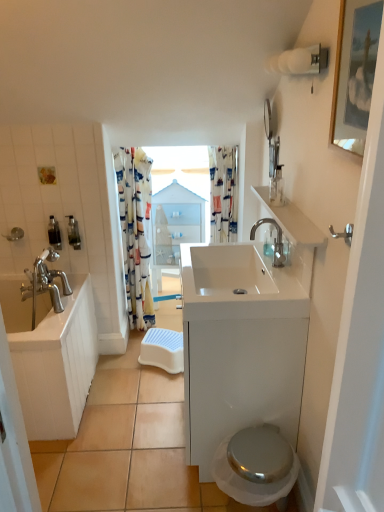
In order to face white glossy sink at upper right, should I rotate leftwards or rightwards?

You should look right and rotate roughly 11.846 degrees.

Image resolution: width=384 pixels, height=512 pixels. In order to click on white glossy sink at center in this screenshot , I will do `click(242, 283)`.

This screenshot has width=384, height=512. I want to click on white glossy cabinet at center, so click(241, 344).

At what (x,y) coordinates should I click in order to perform the action: click on metallic silver soap dispenser at left, acting as the 2th toiletry starting from the back. Please return your answer as a coordinate pair (x, y). Looking at the image, I should click on (54, 233).

Describe the element at coordinates (51, 355) in the screenshot. The width and height of the screenshot is (384, 512). I see `white glossy bathtub at left` at that location.

What is the approximate height of printed fabric shower curtain at center, which is the first shower curtain from right to left?

24.79 inches.

What are the coordinates of `white glossy sink at upper right` in the screenshot? It's located at (292, 221).

From a real-world perspective, which is physically above, silver metallic towel bar at upper right or white glossy bathtub at left?

silver metallic towel bar at upper right.

Is silver metallic towel bar at upper right looking in the opposite direction of white glossy bathtub at left?

No, silver metallic towel bar at upper right is not facing the opposite direction of white glossy bathtub at left.

Does silver metallic towel bar at upper right have a larger size compared to white glossy bathtub at left?

Incorrect, silver metallic towel bar at upper right is not larger than white glossy bathtub at left.

Choose the correct answer: Is silver metallic towel bar at upper right inside white glossy bathtub at left or outside it?

The correct answer is: outside.

From a real-world perspective, between metallic silver soap dispenser at left, positioned as the second toiletry in front-to-back order, and silver metallic towel bar at upper right, who is vertically higher?

silver metallic towel bar at upper right, from a real-world perspective.

Could you measure the distance between metallic silver soap dispenser at left, the first toiletry in the left-to-right sequence, and silver metallic towel bar at upper right?

A distance of 1.66 meters exists between metallic silver soap dispenser at left, the first toiletry in the left-to-right sequence, and silver metallic towel bar at upper right.

Between metallic silver soap dispenser at left, positioned as the second toiletry in front-to-back order, and silver metallic towel bar at upper right, which one has larger width?

Wider between the two is metallic silver soap dispenser at left, positioned as the second toiletry in front-to-back order.

Are metallic silver soap dispenser at left, acting as the 2th toiletry starting from the back, and silver metallic towel bar at upper right far apart?

Yes, metallic silver soap dispenser at left, acting as the 2th toiletry starting from the back, is far from silver metallic towel bar at upper right.

From the image's perspective, which is below, metallic silver toilet at lower right or white glossy sink at upper right?

metallic silver toilet at lower right, from the image's perspective.

Could you tell me if metallic silver toilet at lower right is turned towards white glossy sink at upper right?

No, metallic silver toilet at lower right does not turn towards white glossy sink at upper right.

Between point (287, 480) and point (292, 239), which one is positioned in front?

The point (292, 239) is in front.

Which is in front, printed fabric shower curtain at center, which is the first shower curtain from right to left, or white printed fabric shower curtain at left, the first shower curtain from the left?

white printed fabric shower curtain at left, the first shower curtain from the left.

Is there a large distance between printed fabric shower curtain at center, which is the first shower curtain from right to left, and white printed fabric shower curtain at left, the 2th shower curtain in the right-to-left sequence?

Actually, printed fabric shower curtain at center, which is the first shower curtain from right to left, and white printed fabric shower curtain at left, the 2th shower curtain in the right-to-left sequence, are a little close together.

Considering the relative sizes of printed fabric shower curtain at center, the second shower curtain positioned from the left, and white printed fabric shower curtain at left, the 2th shower curtain in the right-to-left sequence, in the image provided, is printed fabric shower curtain at center, the second shower curtain positioned from the left, taller than white printed fabric shower curtain at left, the 2th shower curtain in the right-to-left sequence,?

No, printed fabric shower curtain at center, the second shower curtain positioned from the left, is not taller than white printed fabric shower curtain at left, the 2th shower curtain in the right-to-left sequence.

Would you say white glossy sink at center is a long distance from white glossy sink at upper right?

No, white glossy sink at center is not far from white glossy sink at upper right.

From a real-world perspective, does white glossy sink at center sit lower than white glossy sink at upper right?

Yes.

Could you tell me if white glossy sink at center is turned towards white glossy sink at upper right?

No, white glossy sink at center is not aimed at white glossy sink at upper right.

In the image, there is a white glossy sink at center. Where is `counter top above it (from the image's perspective)`? counter top above it (from the image's perspective) is located at coordinates (292, 221).

From a real-world perspective, who is located lower, clear glass jar at upper right, marked as the first toiletry in a front-to-back arrangement, or satin nickel faucet at upper right?

satin nickel faucet at upper right is physically lower.

What's the angular difference between clear glass jar at upper right, acting as the third toiletry starting from the left, and satin nickel faucet at upper right's facing directions?

The angular difference between clear glass jar at upper right, acting as the third toiletry starting from the left, and satin nickel faucet at upper right is 0.0057 degrees.

Is clear glass jar at upper right, marked as the first toiletry in a front-to-back arrangement, inside or outside of satin nickel faucet at upper right?

clear glass jar at upper right, marked as the first toiletry in a front-to-back arrangement, cannot be found inside satin nickel faucet at upper right.

Is clear glass jar at upper right, arranged as the first toiletry when viewed from the right, looking in the opposite direction of satin nickel faucet at upper right?

That's not correct — clear glass jar at upper right, arranged as the first toiletry when viewed from the right, is not looking away from satin nickel faucet at upper right.

Is metallic silver toilet at lower right a part of printed fabric shower curtain at center, which is the first shower curtain from right to left?

Actually, metallic silver toilet at lower right is outside printed fabric shower curtain at center, which is the first shower curtain from right to left.

Is printed fabric shower curtain at center, which is the first shower curtain from right to left, aimed at metallic silver toilet at lower right?

Yes, printed fabric shower curtain at center, which is the first shower curtain from right to left, is aimed at metallic silver toilet at lower right.

How many degrees apart are the facing directions of printed fabric shower curtain at center, the second shower curtain positioned from the left, and metallic silver toilet at lower right?

90 degrees separate the facing orientations of printed fabric shower curtain at center, the second shower curtain positioned from the left, and metallic silver toilet at lower right.

I want to click on towel bar that appears in front of the white glossy bathtub at left, so click(x=343, y=233).

At what (x,y) coordinates should I click in order to perform the action: click on towel bar above the metallic silver soap dispenser at left, the first toiletry in the left-to-right sequence (from a real-world perspective). Please return your answer as a coordinate pair (x, y). The image size is (384, 512). Looking at the image, I should click on point(343,233).

Considering their positions, is silver metallic towel bar at upper right positioned closer to white glossy bathtub at left than wooden framed picture at upper right?

silver metallic towel bar at upper right lies closer to white glossy bathtub at left than the other object.

Based on their spatial positions, is white glossy cabinet at center or metallic silver soap dispenser at left, the first toiletry in the left-to-right sequence, closer to wooden framed picture at upper right?

white glossy cabinet at center is positioned closer to the anchor wooden framed picture at upper right.

When comparing their distances from satin nickel faucet at upper right, does white glossy sink at upper right or silver metallic towel bar at upper right seem closer?

Based on the image, white glossy sink at upper right appears to be nearer to satin nickel faucet at upper right.

When comparing their distances from metallic silver toilet at lower right, does satin nickel faucet at upper right or clear glass jar at upper right, acting as the third toiletry starting from the left, seem closer?

satin nickel faucet at upper right is closer to metallic silver toilet at lower right.

Considering their positions, is glossy glass mirror at upper right positioned closer to clear glass jar at upper right, marked as the first toiletry in a front-to-back arrangement, than metallic silver soap dispenser at left, which ranks as the third toiletry in right-to-left order?

glossy glass mirror at upper right is positioned closer to the anchor clear glass jar at upper right, marked as the first toiletry in a front-to-back arrangement.

When comparing their distances from satin nickel faucet at upper right, does glossy glass mirror at upper right or white glossy sink at upper right seem closer?

Based on the image, white glossy sink at upper right appears to be nearer to satin nickel faucet at upper right.

Which object lies further to the anchor point metallic silver soap dispenser at left, acting as the 2th toiletry starting from the back, white glossy bathtub at left or white glossy sink at center?

white glossy sink at center lies further to metallic silver soap dispenser at left, acting as the 2th toiletry starting from the back, than the other object.

Estimate the real-world distances between objects in this image. Which object is further from metallic silver soap dispenser at left, the first toiletry in the left-to-right sequence, white glossy medicine cabinet at center or satin nickel faucet at upper right?

satin nickel faucet at upper right lies further to metallic silver soap dispenser at left, the first toiletry in the left-to-right sequence, than the other object.

Image resolution: width=384 pixels, height=512 pixels. In order to click on tap between wooden framed picture at upper right and printed fabric shower curtain at center, the second shower curtain positioned from the left, from front to back in this screenshot , I will do `click(275, 240)`.

Where is `shower curtain between clear glass jar at upper right, marked as the first toiletry in a front-to-back arrangement, and printed fabric shower curtain at center, which is the first shower curtain from right to left, from front to back`? This screenshot has height=512, width=384. shower curtain between clear glass jar at upper right, marked as the first toiletry in a front-to-back arrangement, and printed fabric shower curtain at center, which is the first shower curtain from right to left, from front to back is located at coordinates (136, 232).

Find the location of a particular element. sink between white glossy sink at upper right and white glossy medicine cabinet at center in the front-back direction is located at coordinates (242, 283).

Find the location of a particular element. This screenshot has width=384, height=512. tap between metallic silver soap dispenser at left, which is the second toiletry in left-to-right order, and glossy glass mirror at upper right is located at coordinates (275, 240).